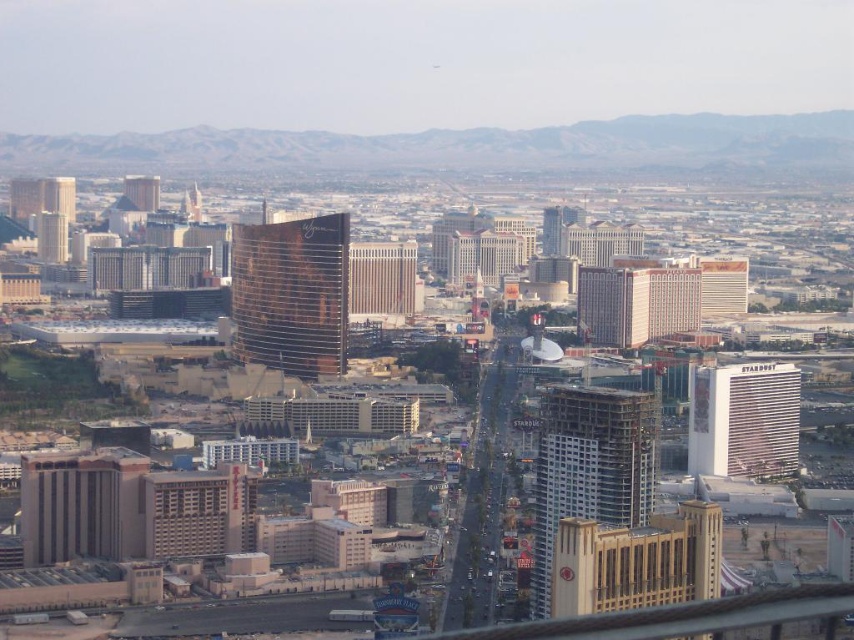
This screenshot has height=640, width=854. What do you see at coordinates (589, 467) in the screenshot? I see `metallic glass skyscraper at center` at bounding box center [589, 467].

Is metallic glass skyscraper at center to the left of white glossy hotel at right from the viewer's perspective?

Correct, you'll find metallic glass skyscraper at center to the left of white glossy hotel at right.

Between point (635, 513) and point (712, 468), which one is positioned in front?

Point (635, 513) is more forward.

This screenshot has width=854, height=640. What are the coordinates of `metallic glass skyscraper at center` in the screenshot? It's located at (589, 467).

Can you confirm if rusty metal tower at center is shorter than white glossy hotel at center-right?

No.

Can you confirm if rusty metal tower at center is thinner than white glossy hotel at center-right?

In fact, rusty metal tower at center might be wider than white glossy hotel at center-right.

Where is `rusty metal tower at center`? The image size is (854, 640). rusty metal tower at center is located at coordinates (291, 292).

Is brown textured building at center positioned at the back of white glossy hotel at center-right?

No.

Does brown textured building at center appear on the left side of white glossy hotel at center-right?

Yes, brown textured building at center is to the left of white glossy hotel at center-right.

Between point (357, 310) and point (705, 308), which one is positioned behind?

The point (705, 308) is more distant.

Locate an element on the screen. brown textured building at center is located at coordinates (382, 278).